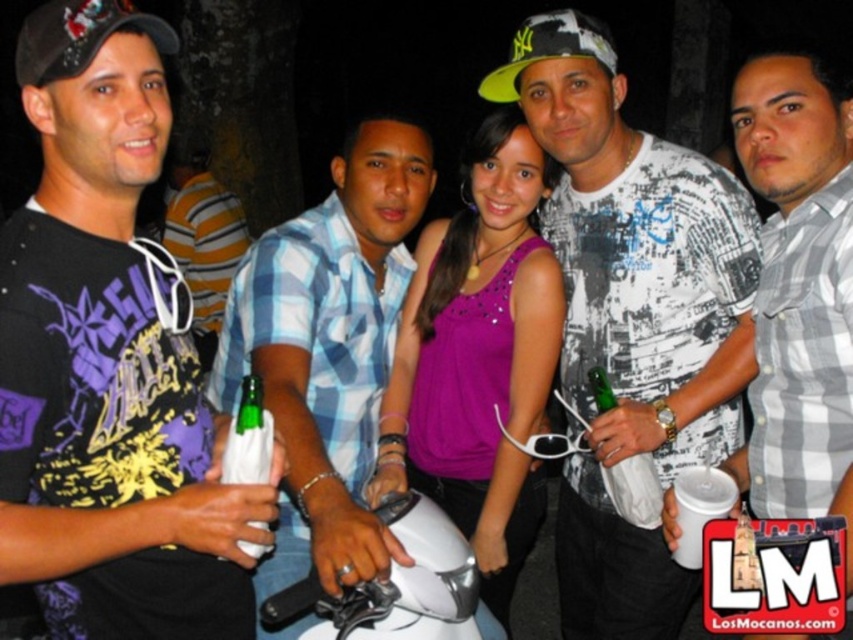
Question: Based on their relative distances, which object is nearer to the white printed shirt at center?

Choices:
 (A) blue plaid shirt at center
 (B) gray checkered shirt at center
 (C) brushed metal bottle at left
 (D) white matte motorcycle at center

Answer: (B)

Question: Is blue plaid shirt at center smaller than matte black cap at upper left?

Choices:
 (A) yes
 (B) no

Answer: (B)

Question: Which object is farther from the camera taking this photo?

Choices:
 (A) white matte motorcycle at center
 (B) brushed metal bottle at left
 (C) matte black cap at upper left
 (D) striped shirt at center

Answer: (D)

Question: Can you confirm if blue plaid shirt at center is wider than green glass bottle at center?

Choices:
 (A) yes
 (B) no

Answer: (A)

Question: Among these points, which one is farthest from the camera?

Choices:
 (A) (747, 336)
 (B) (277, 410)
 (C) (396, 536)

Answer: (A)

Question: Can you confirm if white matte motorcycle at center is bigger than neon yellow fabric baseball cap at center?

Choices:
 (A) no
 (B) yes

Answer: (A)